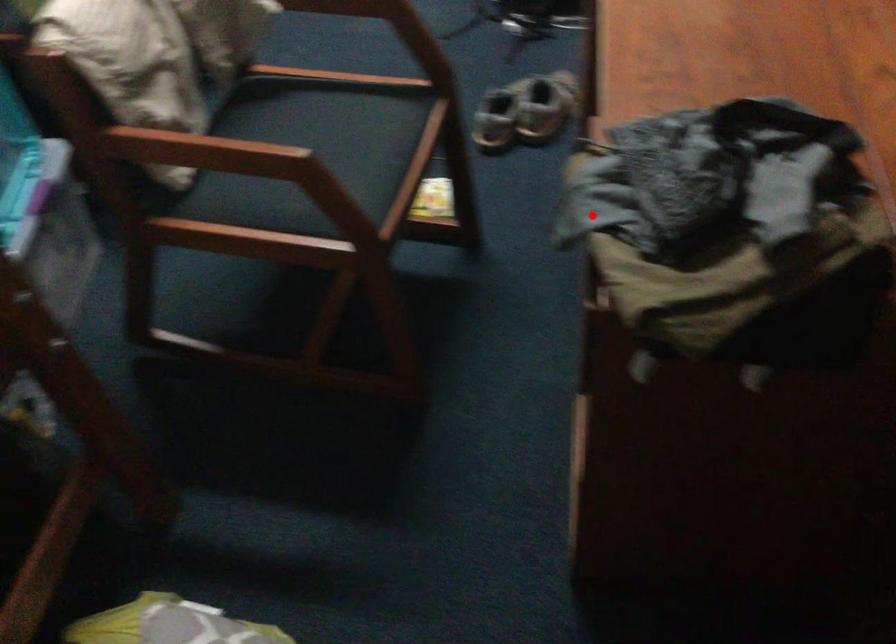
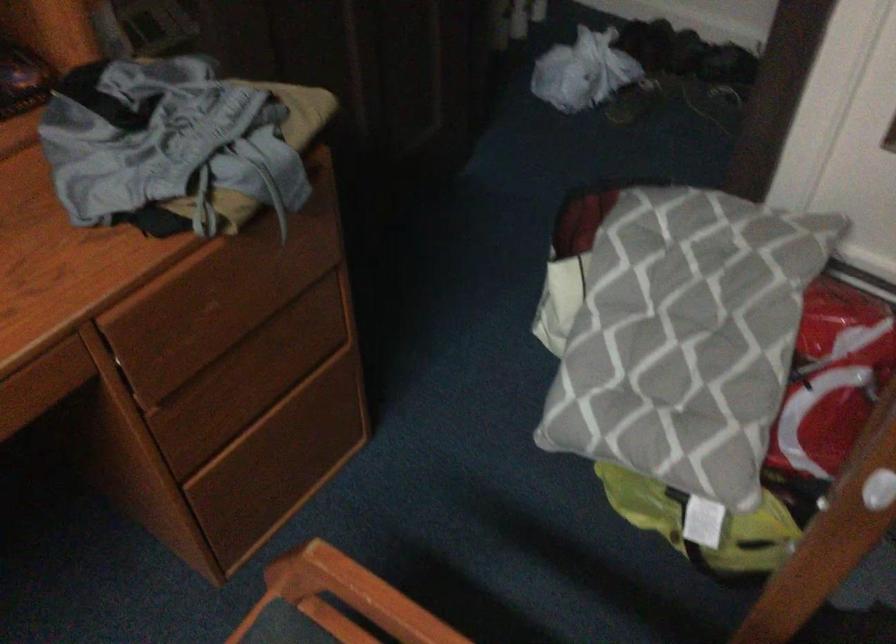
Question: I am providing you with two images of the same scene from different viewpoints. Image1 has a red point marked. In image2, the corresponding 3D location appears at what relative position? Reply with the corresponding letter.

Choices:
 (A) Closer
 (B) Farther

Answer: (B)